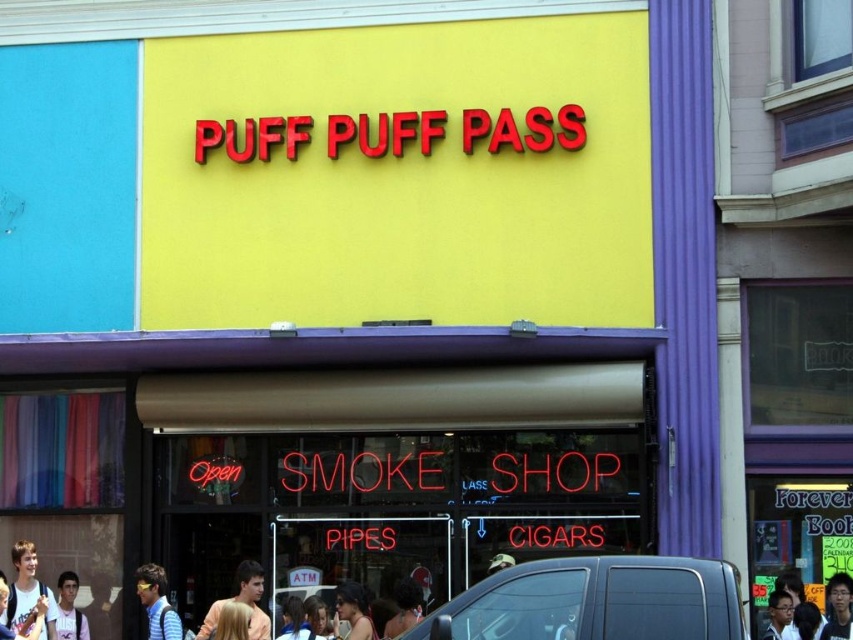
You are standing outside the PUFF PUFF PASS store and see a person with blonde hair at center. If you want to greet them, would you need to enter the store to do so?

The blonde hair at center is 114.66 feet away from viewer, so you would need to enter the store to greet them since they are inside the store and far away.

You are standing outside the PUFF PUFF PASS store and see two people with light brown hair at lower left and smooth black hair at lower right. If you want to greet both of them, which direction should you walk to first reach the closer one?

Both light brown hair at lower left and smooth black hair at lower right are 66.90 feet away from you. Since they are equidistant, you can choose either direction to greet them first.